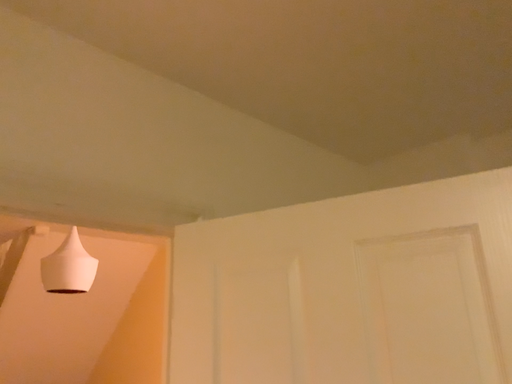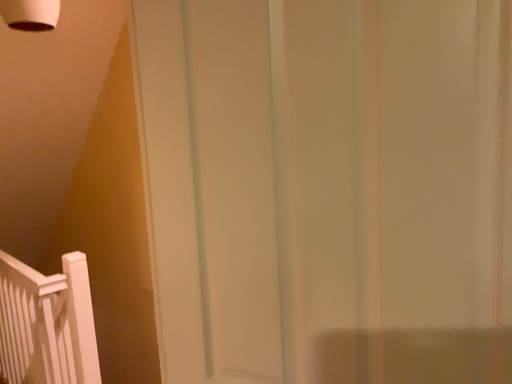
Question: Which way did the camera rotate in the video?

Choices:
 (A) rotated upward
 (B) rotated downward

Answer: (B)